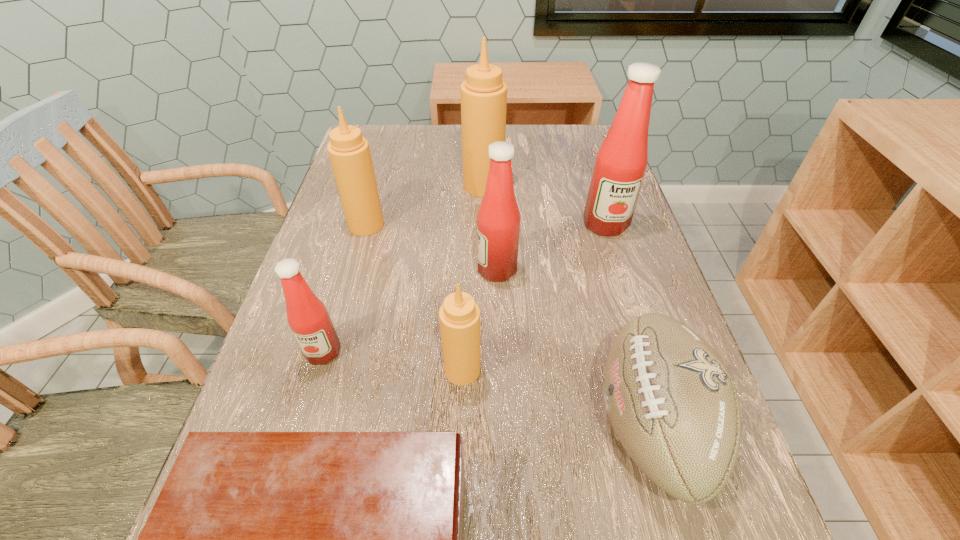
The height and width of the screenshot is (540, 960). Find the location of `free spot between the third nearest condiment and the rightmost condiment`. free spot between the third nearest condiment and the rightmost condiment is located at coordinates (551, 247).

The width and height of the screenshot is (960, 540). In order to click on free spot between the nearest tan condiment and the second farthest tan condiment in this screenshot , I will do tap(415, 297).

Identify the location of the second closest object relative to the radio receiver. The height and width of the screenshot is (540, 960). (308, 318).

You are a GUI agent. You are given a task and a screenshot of the screen. Output one action in this format:
    pyautogui.click(x=<x>, y=<y>)
    Task: Click on the object that is the closest one to the radio receiver
    The width and height of the screenshot is (960, 540).
    Given the screenshot: What is the action you would take?
    pyautogui.click(x=459, y=316)

Identify which condiment is the third closest to the smallest tan condiment. Please provide its 2D coordinates. Your answer should be formatted as a tuple, i.e. [(x, y)], where the tuple contains the x and y coordinates of a point satisfying the conditions above.

[(349, 152)]

This screenshot has width=960, height=540. I want to click on the third closest condiment to the farthest condiment, so click(x=498, y=220).

Image resolution: width=960 pixels, height=540 pixels. Find the location of `the second closest tan condiment to the biggest tan condiment`. the second closest tan condiment to the biggest tan condiment is located at coordinates (459, 316).

At what (x,y) coordinates should I click in order to perform the action: click on the second closest tan condiment to the farthest condiment. Please return your answer as a coordinate pair (x, y). Image resolution: width=960 pixels, height=540 pixels. Looking at the image, I should click on (459, 316).

Find the location of a particular element. This screenshot has width=960, height=540. the closest red condiment to the radio receiver is located at coordinates point(308,318).

Identify the location of red condiment that can be found as the third closest to the second farthest tan condiment. The height and width of the screenshot is (540, 960). (621, 161).